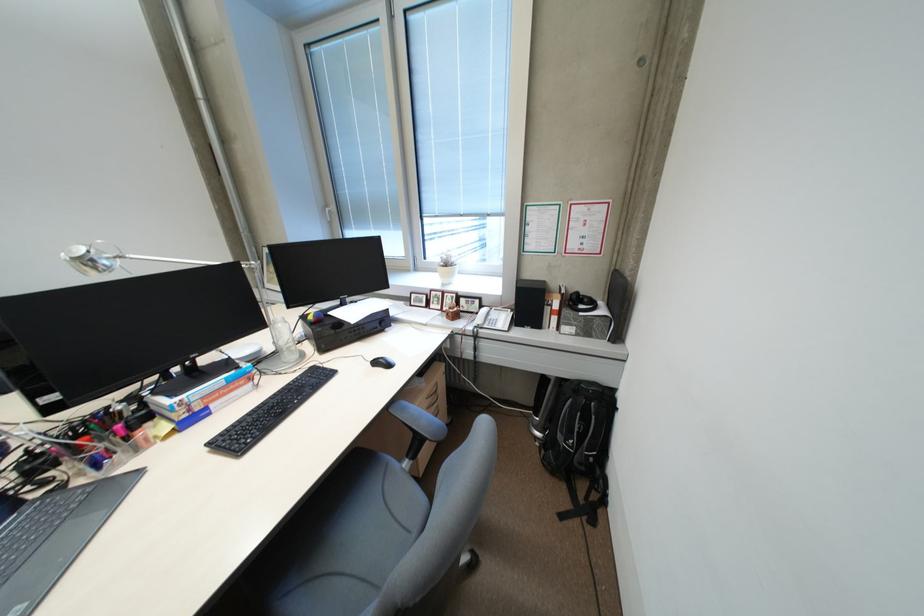
You are a GUI agent. You are given a task and a screenshot of the screen. Output one action in this format:
    pyautogui.click(x=<x>, y=<y>)
    Task: Click on the black receiver dial
    
    Given the screenshot: What is the action you would take?
    pyautogui.click(x=580, y=302)